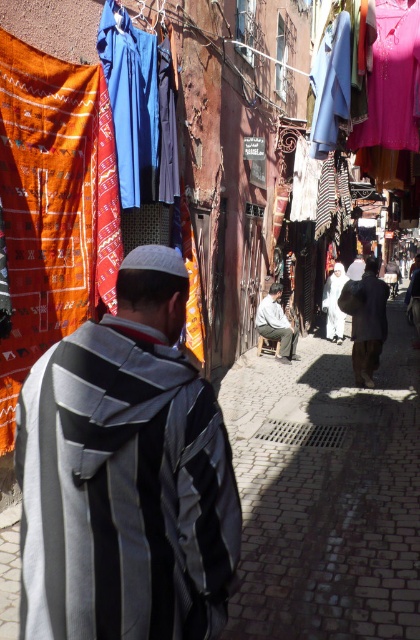
Is point (382, 294) behind point (265, 330)?

No, (382, 294) is closer to viewer.

Between point (375, 314) and point (257, 324), which one is positioned behind?

Point (257, 324)

Where is `dark gray fabric bag at center`? dark gray fabric bag at center is located at coordinates (365, 321).

Image resolution: width=420 pixels, height=640 pixels. What do you see at coordinates (126, 476) in the screenshot?
I see `striped woolen shawl at center` at bounding box center [126, 476].

The height and width of the screenshot is (640, 420). Describe the element at coordinates (126, 476) in the screenshot. I see `striped woolen shawl at center` at that location.

Find the location of a particular element. striped woolen shawl at center is located at coordinates (126, 476).

Between striped woolen shawl at center and dark gray fabric bag at center, which one has more height?

Standing taller between the two is dark gray fabric bag at center.

Is point (65, 403) positioned after point (357, 356)?

No, it is in front of (357, 356).

Does point (39, 472) come farther from viewer compared to point (367, 365)?

No, (39, 472) is in front of (367, 365).

At what (x,y) coordinates should I click in order to perform the action: click on striped woolen shawl at center. Please return your answer as a coordinate pair (x, y). The width and height of the screenshot is (420, 640). Looking at the image, I should click on (126, 476).